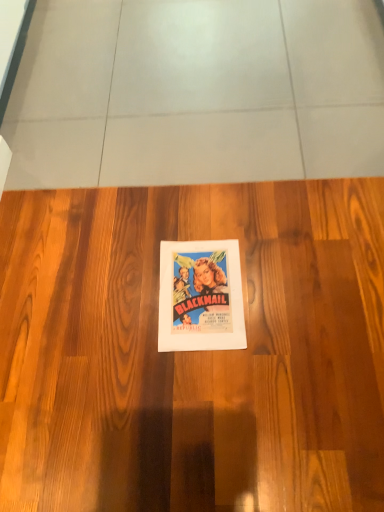
Question: Is wooden floor at center in front of or behind vibrant paper poster at center in the image?

Choices:
 (A) front
 (B) behind

Answer: (A)

Question: Is point (379, 203) positioned closer to the camera than point (192, 308)?

Choices:
 (A) farther
 (B) closer

Answer: (A)

Question: In terms of height, does wooden floor at center look taller or shorter compared to vibrant paper poster at center?

Choices:
 (A) short
 (B) tall

Answer: (B)

Question: In the image, is vibrant paper poster at center on the left side or the right side of wooden floor at center?

Choices:
 (A) left
 (B) right

Answer: (B)

Question: Is point (243, 313) closer or farther from the camera than point (150, 448)?

Choices:
 (A) farther
 (B) closer

Answer: (A)

Question: Is vibrant paper poster at center taller or shorter than wooden floor at center?

Choices:
 (A) tall
 (B) short

Answer: (B)

Question: From a real-world perspective, is vibrant paper poster at center positioned above or below wooden floor at center?

Choices:
 (A) above
 (B) below

Answer: (A)